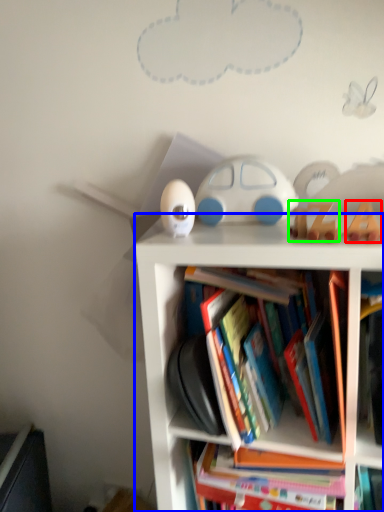
Question: Considering the real-world distances, which object is farthest from toy (highlighted by a red box)? bookcase (highlighted by a blue box) or toy (highlighted by a green box)?

Choices:
 (A) bookcase
 (B) toy

Answer: (A)